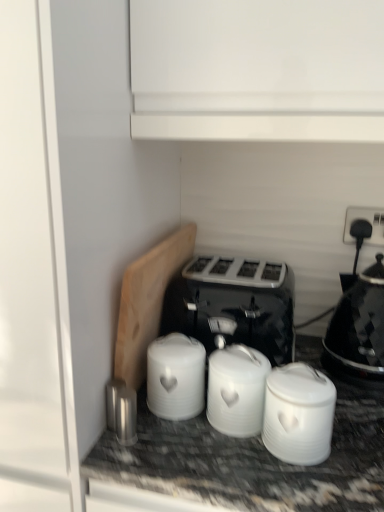
Question: Is the depth of white matte jar at center, positioned as the first appliance in right-to-left order, greater than that of black glossy kettle at right?

Choices:
 (A) yes
 (B) no

Answer: (B)

Question: Considering the relative sizes of white matte jar at center, the 4th appliance when ordered from left to right, and black glossy kettle at right in the image provided, is white matte jar at center, the 4th appliance when ordered from left to right, taller than black glossy kettle at right?

Choices:
 (A) yes
 (B) no

Answer: (B)

Question: Would you say white matte jar at center, positioned as the first appliance in right-to-left order, contains black glossy kettle at right?

Choices:
 (A) no
 (B) yes

Answer: (A)

Question: Is white matte jar at center, positioned as the first appliance in right-to-left order, to the right of black glossy kettle at right from the viewer's perspective?

Choices:
 (A) no
 (B) yes

Answer: (A)

Question: Is white matte jar at center, positioned as the first appliance in right-to-left order, not close to black glossy kettle at right?

Choices:
 (A) yes
 (B) no

Answer: (B)

Question: From the image's perspective, is white matte jar at center, positioned as the first appliance in right-to-left order, on black glossy kettle at right?

Choices:
 (A) no
 (B) yes

Answer: (A)

Question: From a real-world perspective, is white ceramic canister at center, the 3th appliance in the right-to-left sequence, under white matte canisters at center, which is the third appliance in left-to-right order?

Choices:
 (A) yes
 (B) no

Answer: (A)

Question: Is white ceramic canister at center, the 3th appliance in the right-to-left sequence, located outside white matte canisters at center, the second appliance positioned from the right?

Choices:
 (A) yes
 (B) no

Answer: (A)

Question: Is white ceramic canister at center, the 3th appliance in the right-to-left sequence, bigger than white matte canisters at center, which is the third appliance in left-to-right order?

Choices:
 (A) yes
 (B) no

Answer: (A)

Question: From the image's perspective, is white ceramic canister at center, the 3th appliance in the right-to-left sequence, under white matte canisters at center, which is the third appliance in left-to-right order?

Choices:
 (A) no
 (B) yes

Answer: (A)

Question: From the image's perspective, is white ceramic canister at center, arranged as the 2th appliance when viewed from the left, above white matte canisters at center, which is the third appliance in left-to-right order?

Choices:
 (A) yes
 (B) no

Answer: (A)

Question: Can you confirm if white ceramic canister at center, the 3th appliance in the right-to-left sequence, is smaller than white matte canisters at center, the second appliance positioned from the right?

Choices:
 (A) yes
 (B) no

Answer: (B)

Question: Is black glossy kettle at right taller than white matte canisters at center, which is the third appliance in left-to-right order?

Choices:
 (A) no
 (B) yes

Answer: (B)